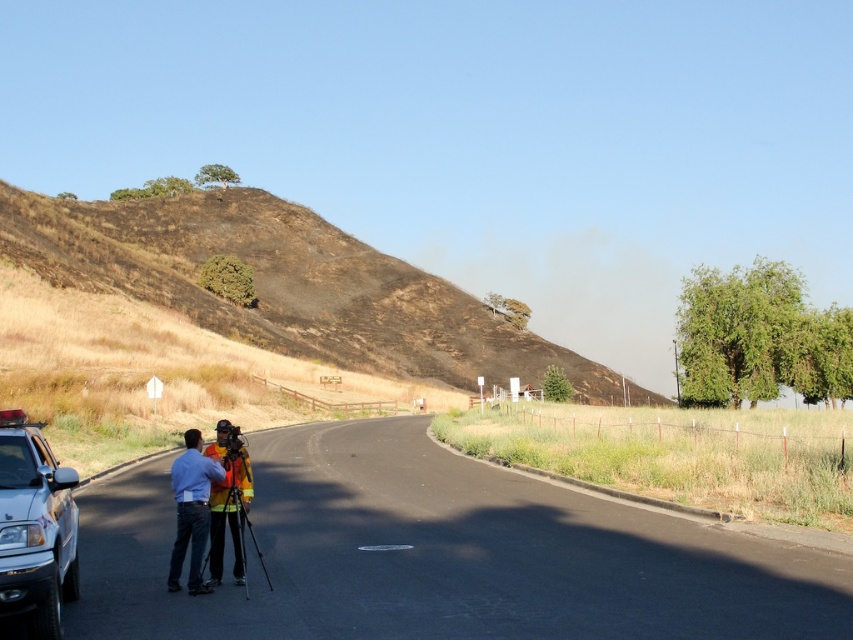
Who is positioned more to the right, burnt grass at upper left or reflective yellow safety vest at center?

reflective yellow safety vest at center

Does burnt grass at upper left appear on the right side of reflective yellow safety vest at center?

Incorrect, burnt grass at upper left is not on the right side of reflective yellow safety vest at center.

Does point (274, 314) come farther from viewer compared to point (199, 445)?

Yes, point (274, 314) is farther from viewer.

Locate an element on the screen. The height and width of the screenshot is (640, 853). burnt grass at upper left is located at coordinates (283, 284).

Who is positioned more to the left, burnt grass at upper left or silver metallic truck at lower left?

burnt grass at upper left is more to the left.

Is burnt grass at upper left below silver metallic truck at lower left?

No, burnt grass at upper left is not below silver metallic truck at lower left.

Find the location of a particular element. This screenshot has height=640, width=853. burnt grass at upper left is located at coordinates (283, 284).

In the scene shown: Who is more forward, [36,522] or [196,516]?

Point [36,522] is in front.

In the scene shown: Can you confirm if silver metallic truck at lower left is positioned above reflective yellow safety vest at center?

Yes.

Between point (30, 516) and point (192, 458), which one is positioned in front?

Positioned in front is point (30, 516).

Identify the location of silver metallic truck at lower left. The width and height of the screenshot is (853, 640). (35, 528).